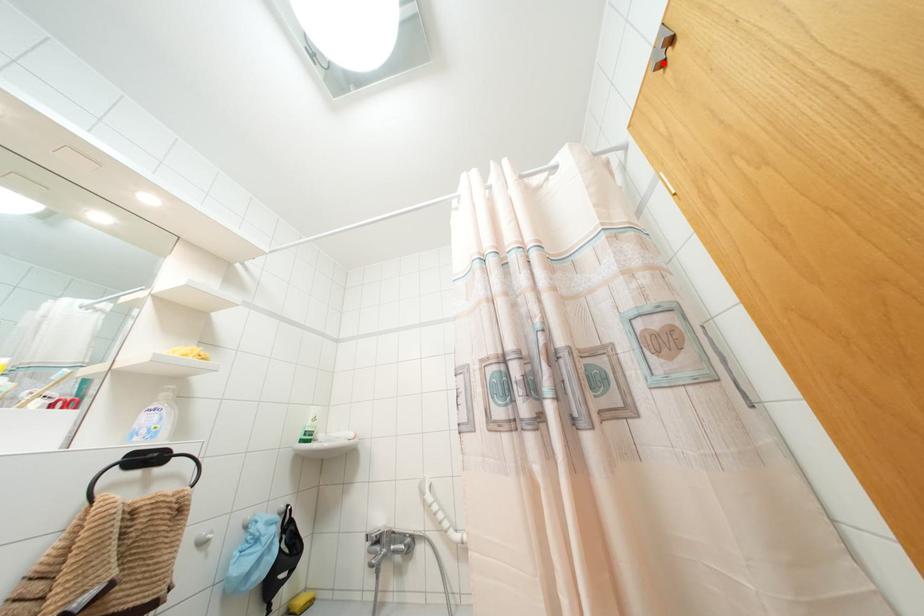
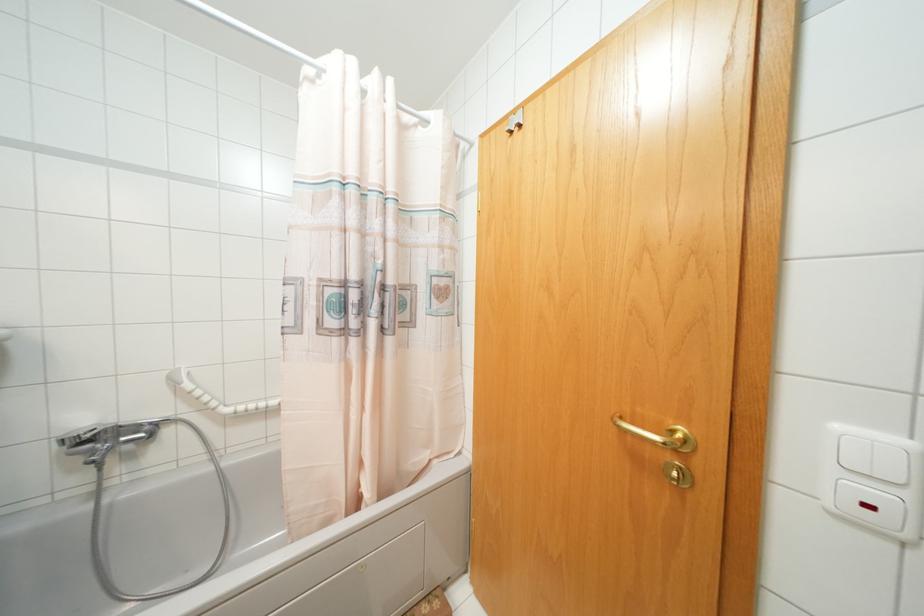
Locate, in the second image, the point that corresponds to the highlighted location in the first image.

(511, 132)